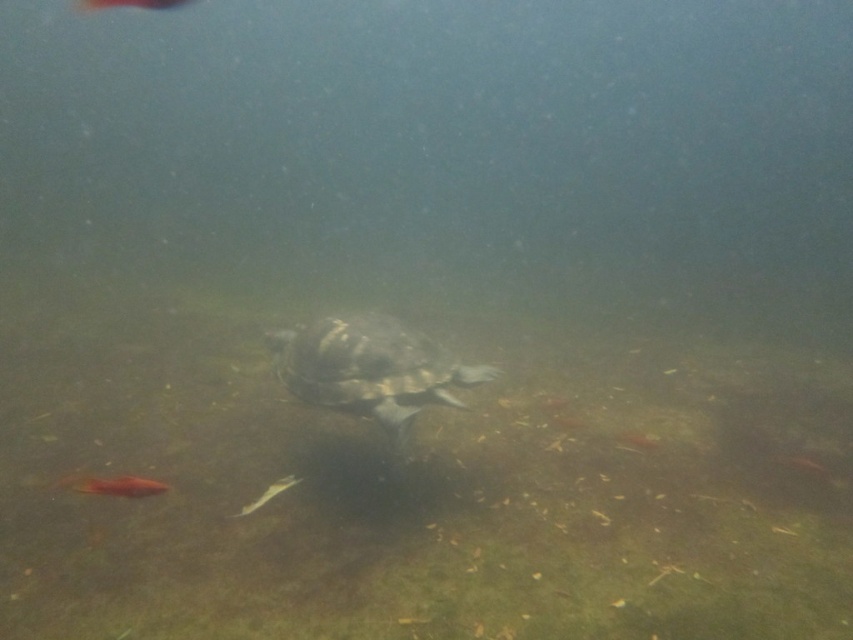
Question: Does brown textured shell at center have a lesser width compared to translucent orange fish at center?

Choices:
 (A) no
 (B) yes

Answer: (A)

Question: Estimate the real-world distances between objects in this image. Which object is farther from the translucent orange fish at center?

Choices:
 (A) shiny orange fish at center
 (B) brown textured shell at center

Answer: (A)

Question: Where is brown textured shell at center located in relation to shiny orange fish at center in the image?

Choices:
 (A) above
 (B) below

Answer: (B)

Question: Which object is the farthest from the brown textured shell at center?

Choices:
 (A) translucent orange fish at center
 (B) shiny orange fish at center

Answer: (B)

Question: Among these objects, which one is nearest to the camera?

Choices:
 (A) brown textured shell at center
 (B) translucent orange fish at center

Answer: (B)

Question: Can you confirm if brown textured shell at center is positioned below shiny orange fish at center?

Choices:
 (A) yes
 (B) no

Answer: (A)